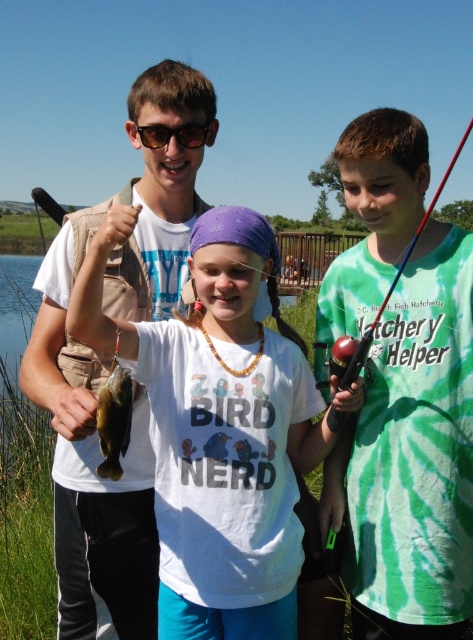
Which is behind, point (175, 582) or point (199, 132)?

The point (199, 132) is more distant.

Can you confirm if white matte shirt at center is wider than black plastic sunglasses at upper center?

Yes, white matte shirt at center is wider than black plastic sunglasses at upper center.

Is point (159, 612) closer to viewer compared to point (181, 134)?

Yes, point (159, 612) is in front of point (181, 134).

This screenshot has width=473, height=640. I want to click on white matte shirt at center, so click(x=219, y=432).

Can you confirm if white matte shirt at center is positioned below shiny green fish at center?

Yes, white matte shirt at center is below shiny green fish at center.

Is point (218, 346) farther from viewer compared to point (120, 410)?

Yes, it is.

Which is in front, point (182, 627) or point (130, 388)?

Point (130, 388)

What are the coordinates of `white matte shirt at center` in the screenshot? It's located at (219, 432).

Who is more distant from viewer, (x=423, y=195) or (x=183, y=138)?

The point (x=183, y=138) is behind.

Is point (415, 618) positioned after point (192, 145)?

No.

Image resolution: width=473 pixels, height=640 pixels. Find the location of `green tie-dye shirt at center`. green tie-dye shirt at center is located at coordinates 411,454.